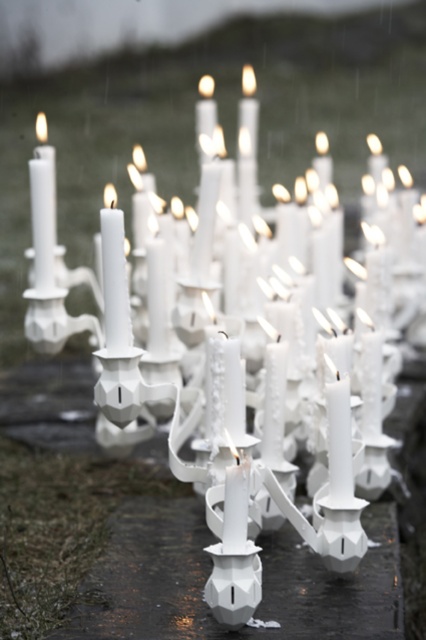
Describe the element at coordinates (115, 282) in the screenshot. I see `white matte candle at center` at that location.

Does white matte candle at center appear on the left side of white matte candle at left?

Incorrect, white matte candle at center is not on the left side of white matte candle at left.

Who is more distant from viewer, (118,300) or (46,134)?

The point (46,134) is more distant.

Find the location of `white matte candle at center`. white matte candle at center is located at coordinates (115, 282).